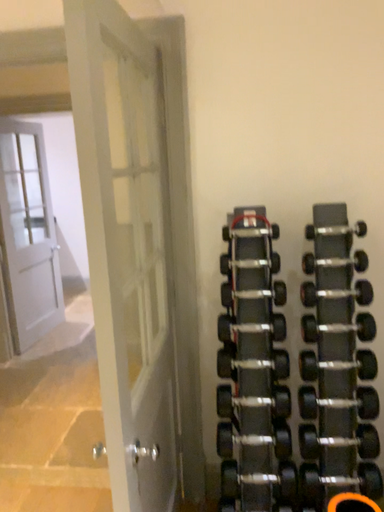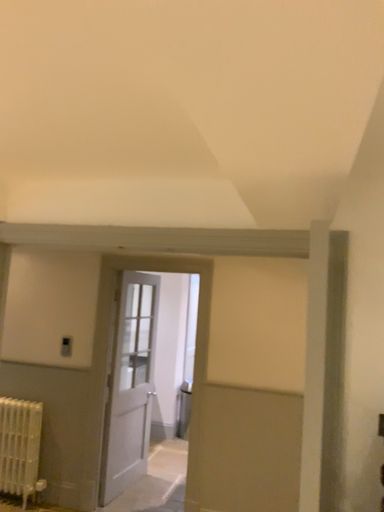
Question: Which way did the camera rotate in the video?

Choices:
 (A) rotated upward
 (B) rotated downward

Answer: (A)